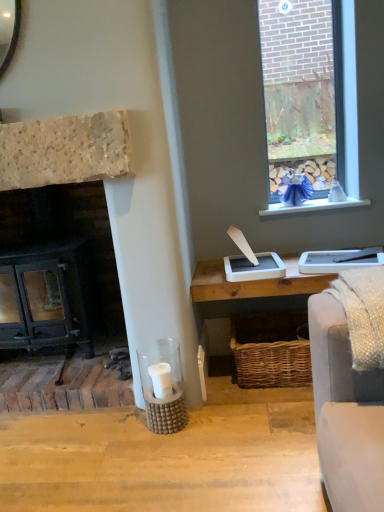
Describe the element at coordinates (311, 206) in the screenshot. I see `white painted wood at upper right` at that location.

In order to face white painted wood at upper right, should I rotate leftwards or rightwards?

To face it directly, rotate right by 15.571 degrees.

Measure the distance between white painted wood at upper right and camera.

white painted wood at upper right and camera are 7.00 feet apart from each other.

Locate an element on the screen. This screenshot has height=512, width=384. white painted wood at upper right is located at coordinates (311, 206).

Describe the element at coordinates (65, 150) in the screenshot. I see `black cast iron fireplace at left` at that location.

What is the approximate height of black cast iron fireplace at left?

It is 35.73 inches.

In order to click on black cast iron fireplace at left in this screenshot , I will do `click(65, 150)`.

Locate an element on the screen. white painted wood at upper right is located at coordinates (311, 206).

Which object is positioned more to the right, black cast iron fireplace at left or white painted wood at upper right?

white painted wood at upper right.

Is black cast iron fireplace at left closer to camera compared to white painted wood at upper right?

Yes, black cast iron fireplace at left is closer to the viewer.

Does point (76, 136) lie behind point (282, 205)?

No, (76, 136) is in front of (282, 205).

Looking at this image, from the image's perspective, which one is positioned lower, black cast iron fireplace at left or white painted wood at upper right?

black cast iron fireplace at left appears lower in the image.

From a real-world perspective, is black cast iron fireplace at left on white painted wood at upper right?

Actually, black cast iron fireplace at left is physically below white painted wood at upper right in the real world.

Considering the sizes of objects black cast iron fireplace at left and white painted wood at upper right in the image provided, who is wider, black cast iron fireplace at left or white painted wood at upper right?

black cast iron fireplace at left.

Does black cast iron fireplace at left have a lesser height compared to white painted wood at upper right?

No.

Can you confirm if black cast iron fireplace at left is smaller than white painted wood at upper right?

Actually, black cast iron fireplace at left might be larger than white painted wood at upper right.

Does black cast iron fireplace at left contain white painted wood at upper right?

No.

Is black cast iron fireplace at left not near white painted wood at upper right?

That's right, there is a large distance between black cast iron fireplace at left and white painted wood at upper right.

Is black cast iron fireplace at left looking in the opposite direction of white painted wood at upper right?

No, black cast iron fireplace at left's orientation is not away from white painted wood at upper right.

How far apart are black cast iron fireplace at left and white painted wood at upper right?

3.36 feet.

Where is `fireplace below the white painted wood at upper right (from the image's perspective)`? fireplace below the white painted wood at upper right (from the image's perspective) is located at coordinates (65, 150).

Which object is positioned more to the right, white painted wood at upper right or black cast iron fireplace at left?

From the viewer's perspective, white painted wood at upper right appears more on the right side.

Which is in front, white painted wood at upper right or black cast iron fireplace at left?

black cast iron fireplace at left is in front.

Is point (291, 212) positioned before point (85, 119)?

That is False.

From the image's perspective, which is below, white painted wood at upper right or black cast iron fireplace at left?

black cast iron fireplace at left.

From a real-world perspective, is white painted wood at upper right above or below black cast iron fireplace at left?

In terms of real-world spatial position, white painted wood at upper right is above black cast iron fireplace at left.

Looking at their sizes, would you say white painted wood at upper right is wider or thinner than black cast iron fireplace at left?

white painted wood at upper right is thinner than black cast iron fireplace at left.

Does white painted wood at upper right have a greater height compared to black cast iron fireplace at left?

In fact, white painted wood at upper right may be shorter than black cast iron fireplace at left.

Consider the image. Looking at the image, does white painted wood at upper right seem bigger or smaller compared to black cast iron fireplace at left?

Considering their sizes, white painted wood at upper right takes up less space than black cast iron fireplace at left.

Would you say white painted wood at upper right is outside black cast iron fireplace at left?

Yes.

Does white painted wood at upper right touch black cast iron fireplace at left?

No, white painted wood at upper right is not next to black cast iron fireplace at left.

Is white painted wood at upper right facing away from black cast iron fireplace at left?

No, white painted wood at upper right is not facing away from black cast iron fireplace at left.

Image resolution: width=384 pixels, height=512 pixels. In order to click on window sill above the black cast iron fireplace at left (from the image's perspective) in this screenshot , I will do `click(311, 206)`.

Where is `window sill above the black cast iron fireplace at left (from a real-world perspective)`? The width and height of the screenshot is (384, 512). window sill above the black cast iron fireplace at left (from a real-world perspective) is located at coordinates (311, 206).

What are the coordinates of `fireplace that is under the white painted wood at upper right (from a real-world perspective)` in the screenshot? It's located at (65, 150).